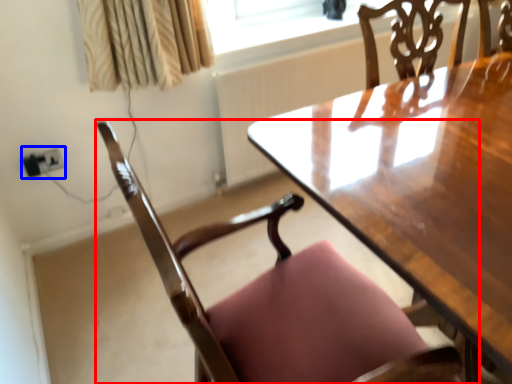
Question: Which of the following is the closest to the observer, chair (highlighted by a red box) or electric outlet (highlighted by a blue box)?

Choices:
 (A) chair
 (B) electric outlet

Answer: (A)